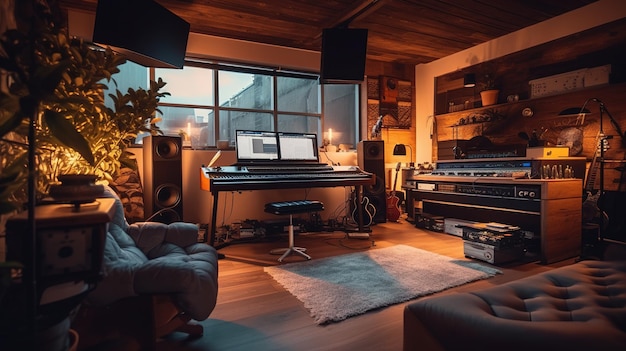
At what (x,y) coordinates should I click in order to perform the action: click on right top speaker. Please return your answer as a coordinate pair (x, y). This screenshot has height=351, width=626. Looking at the image, I should click on (342, 52).